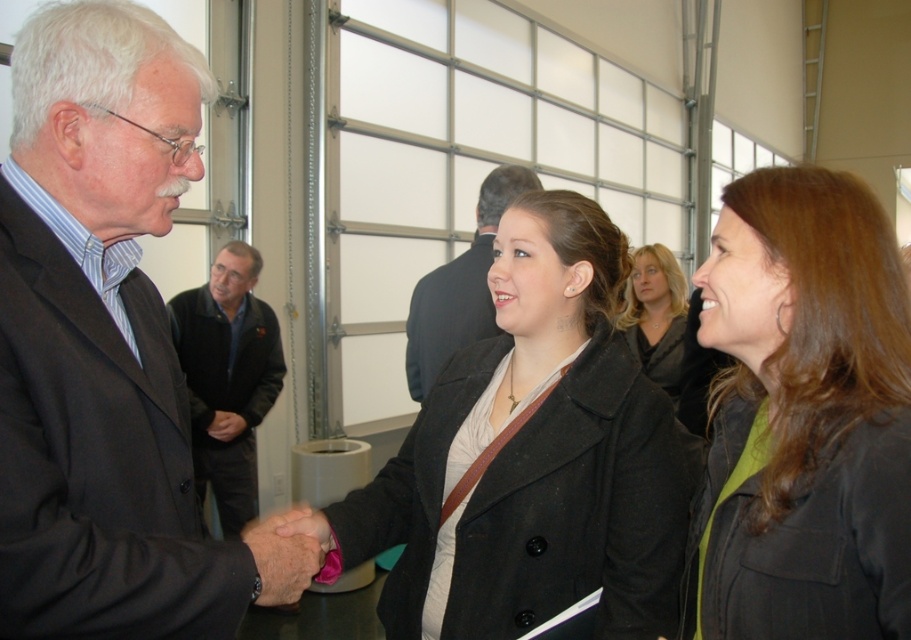
What do you see at coordinates (533, 458) in the screenshot? The image size is (911, 640). I see `matte black coat at center` at bounding box center [533, 458].

This screenshot has width=911, height=640. What do you see at coordinates (533, 458) in the screenshot?
I see `matte black coat at center` at bounding box center [533, 458].

At what (x,y) coordinates should I click in order to perform the action: click on matte black coat at center. Please return your answer as a coordinate pair (x, y). The height and width of the screenshot is (640, 911). Looking at the image, I should click on click(533, 458).

Does dark gray wool suit at left appear over smooth leather hand at center?

Yes, dark gray wool suit at left is above smooth leather hand at center.

The width and height of the screenshot is (911, 640). Find the location of `dark gray wool suit at left`. dark gray wool suit at left is located at coordinates (96, 448).

You are a GUI agent. You are given a task and a screenshot of the screen. Output one action in this format:
    pyautogui.click(x=<x>, y=<y>)
    Task: Click on the dark gray wool suit at left
    
    Given the screenshot: What is the action you would take?
    pyautogui.click(x=96, y=448)

I want to click on dark gray wool suit at left, so click(x=96, y=448).

Which is above, dark gray suit at center or smooth leather hand at center?

Positioned higher is dark gray suit at center.

Can you confirm if dark gray suit at center is positioned below smooth leather hand at center?

Actually, dark gray suit at center is above smooth leather hand at center.

This screenshot has width=911, height=640. I want to click on dark gray suit at center, so click(459, 288).

I want to click on dark gray suit at center, so click(x=459, y=288).